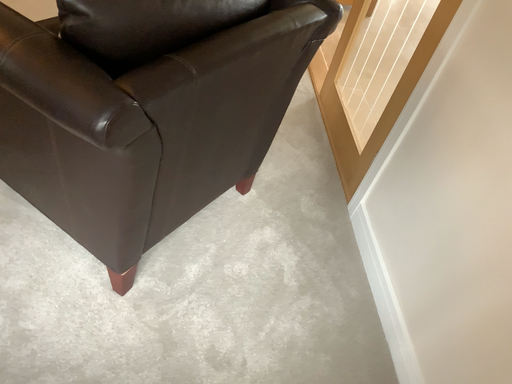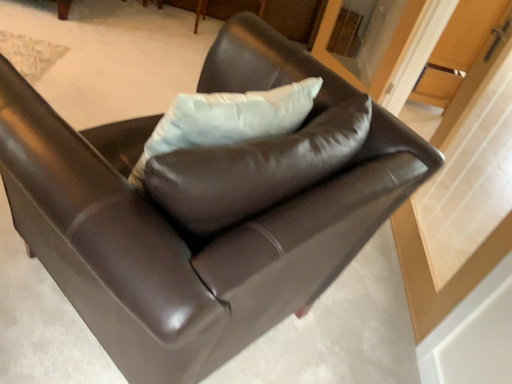
Question: How did the camera likely rotate when shooting the video?

Choices:
 (A) rotated downward
 (B) rotated upward

Answer: (B)